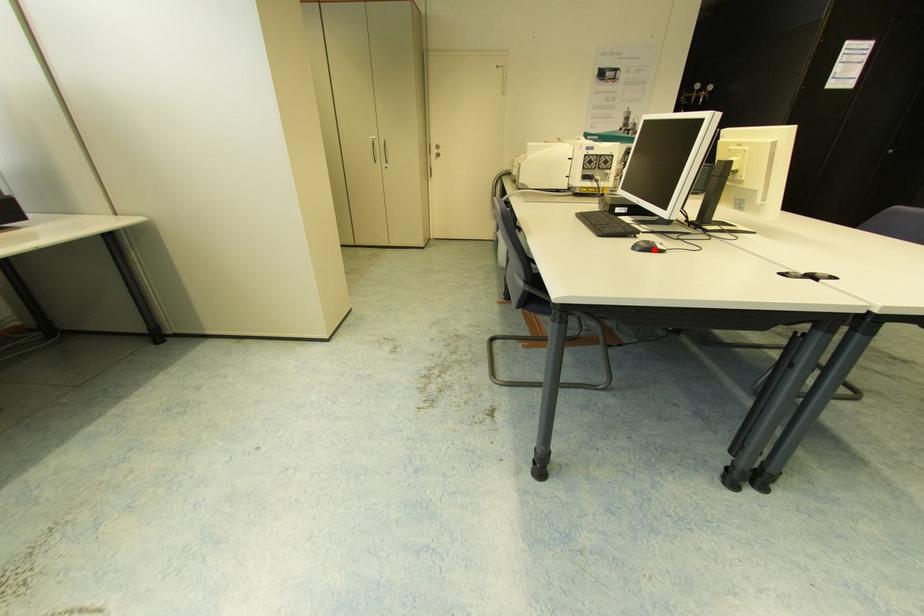
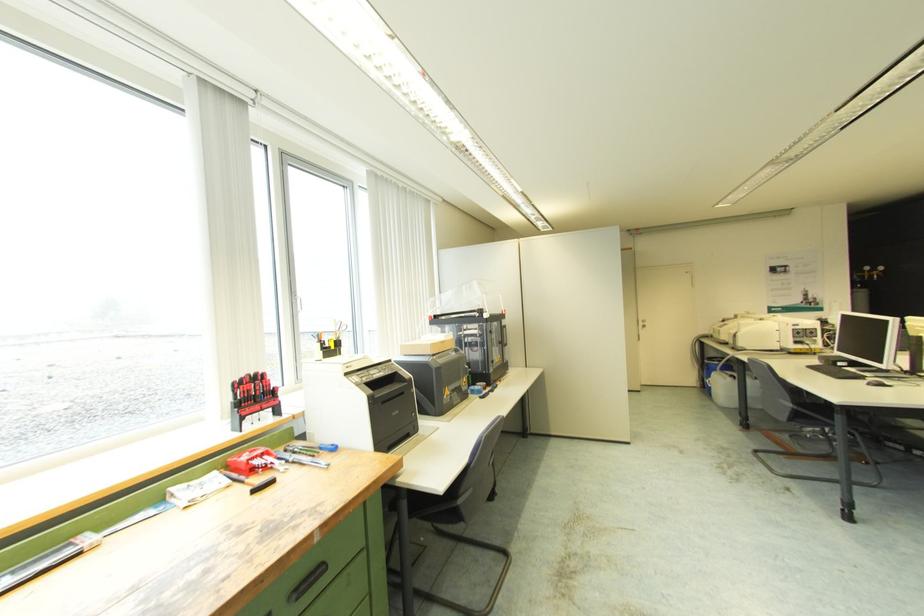
In the second image, find the point that corresponds to the highlighted location in the first image.

(884, 386)